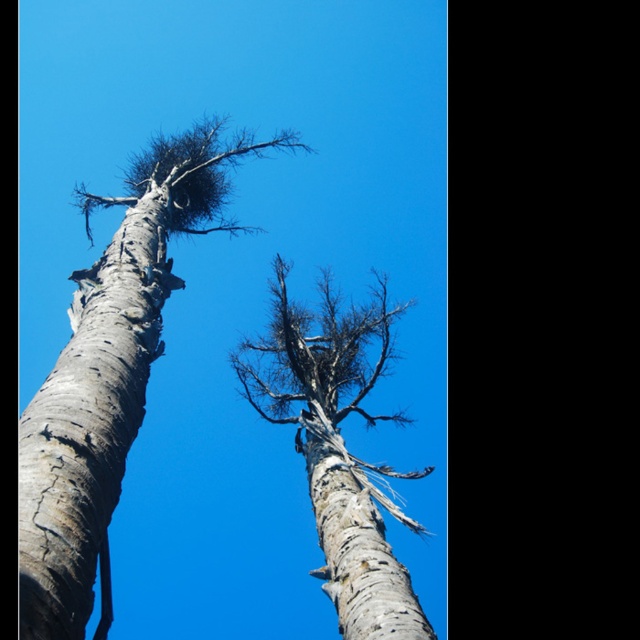
Which is behind, point (80, 481) or point (308, 356)?

The point (308, 356) is more distant.

Where is `gray textured bark at left`? The image size is (640, 640). gray textured bark at left is located at coordinates (88, 422).

Who is more distant from viewer, (116,285) or (275,358)?

The point (275,358) is behind.

Locate an element on the screen. This screenshot has width=640, height=640. gray textured bark at left is located at coordinates (88, 422).

Between point (19, 474) and point (353, 468), which one is positioned in front?

Positioned in front is point (19, 474).

Does gray textured bark at left have a larger size compared to white bark tree trunk at center?

Indeed, gray textured bark at left has a larger size compared to white bark tree trunk at center.

Measure the distance between point (20, 628) and camera.

Point (20, 628) is 4.02 meters away from camera.

Identify the location of gray textured bark at left. The image size is (640, 640). (88, 422).

The height and width of the screenshot is (640, 640). Describe the element at coordinates (108, 376) in the screenshot. I see `gray textured bark birch tree at left` at that location.

Is point (124, 198) behind point (355, 632)?

Yes, point (124, 198) is farther from viewer.

Where is `gray textured bark birch tree at left`? This screenshot has height=640, width=640. gray textured bark birch tree at left is located at coordinates (108, 376).